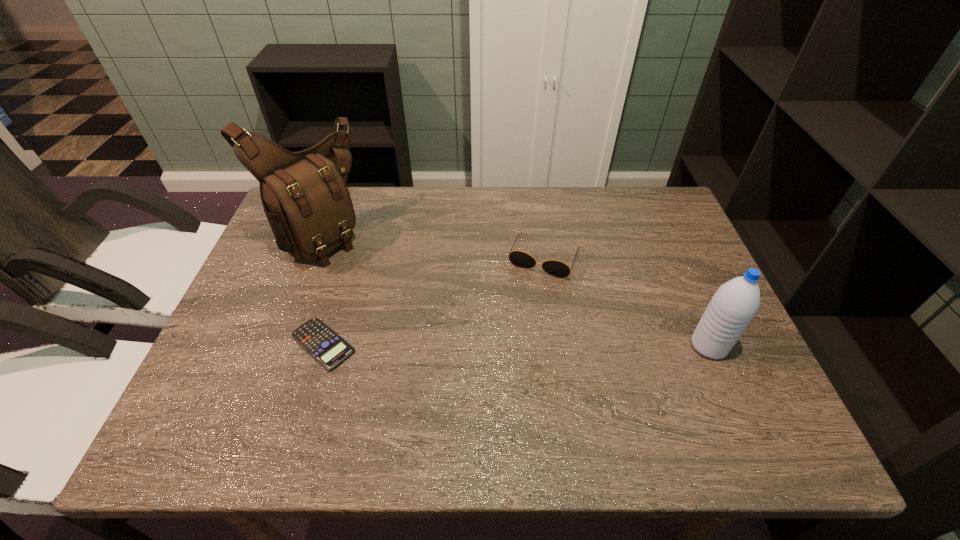
The image size is (960, 540). In order to click on empty location between the tallest object and the third shortest object in this screenshot , I will do [x=515, y=290].

You are a GUI agent. You are given a task and a screenshot of the screen. Output one action in this format:
    pyautogui.click(x=<x>, y=<y>)
    Task: Click on the free space between the shoulder bag and the sunglasses
    Image resolution: width=960 pixels, height=540 pixels.
    Given the screenshot: What is the action you would take?
    pyautogui.click(x=432, y=245)

You are a GUI agent. You are given a task and a screenshot of the screen. Output one action in this format:
    pyautogui.click(x=<x>, y=<y>)
    Task: Click on the vacant area that lies between the calculator and the third shortest object
    Image resolution: width=960 pixels, height=540 pixels.
    Given the screenshot: What is the action you would take?
    [516, 345]

You are a GUI agent. You are given a task and a screenshot of the screen. Output one action in this format:
    pyautogui.click(x=<x>, y=<y>)
    Task: Click on the vacant area between the third shortest object and the second shortest object
    
    Given the screenshot: What is the action you would take?
    pyautogui.click(x=627, y=301)

What are the coordinates of `blank region between the tallest object and the water bottle` in the screenshot? It's located at click(515, 290).

Identify the location of free space that is in between the calculator and the water bottle. (516, 345).

Where is `free space between the third shortest object and the second object from right to left`? free space between the third shortest object and the second object from right to left is located at coordinates (627, 301).

Image resolution: width=960 pixels, height=540 pixels. I want to click on object that ranks as the third closest to the shoulder bag, so click(x=733, y=306).

Locate which object ranks in proximity to the sunglasses. Please provide its 2D coordinates. Your answer should be formatted as a tuple, i.e. [(x, y)], where the tuple contains the x and y coordinates of a point satisfying the conditions above.

[(733, 306)]

Where is `vacant point that satisfies the following two spatial constraints: 1. on the front side of the tallest object; 2. on the left side of the calculator`? This screenshot has width=960, height=540. vacant point that satisfies the following two spatial constraints: 1. on the front side of the tallest object; 2. on the left side of the calculator is located at coordinates (277, 344).